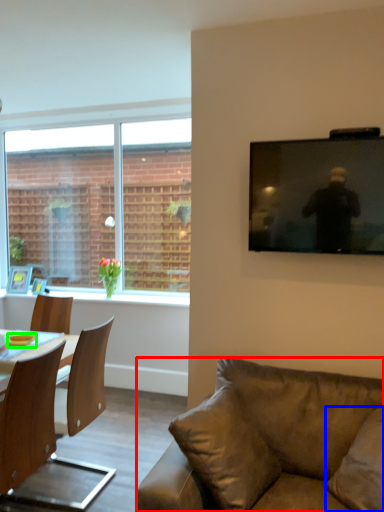
Question: Which is farther away from studio couch (highlighted by a red box)? pillow (highlighted by a blue box) or bowl (highlighted by a green box)?

Choices:
 (A) pillow
 (B) bowl

Answer: (B)